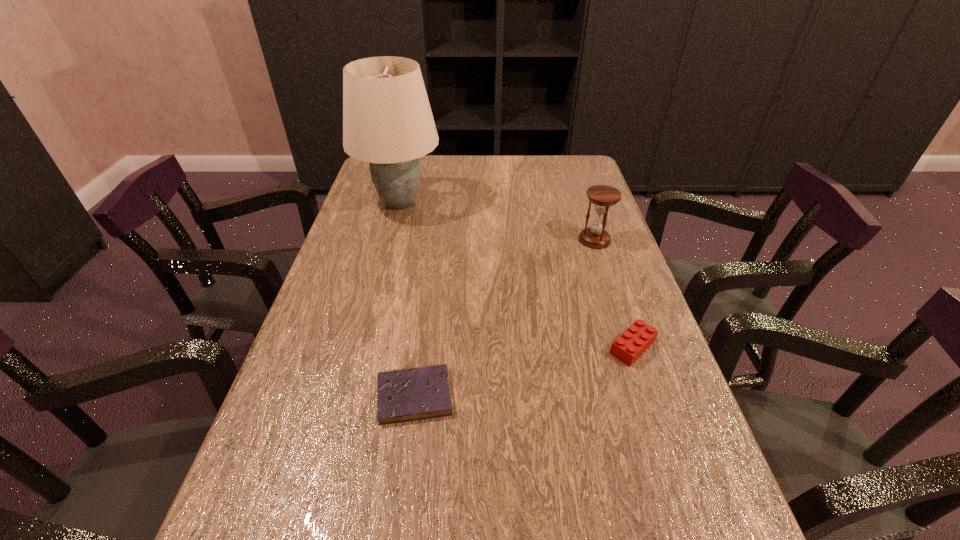
Where is `blank region between the tallest object and the nearest object`? Image resolution: width=960 pixels, height=540 pixels. blank region between the tallest object and the nearest object is located at coordinates (407, 299).

I want to click on object identified as the third closest to the third shortest object, so click(x=419, y=393).

Point out which object is positioned as the nearest to the farthest object. Please provide its 2D coordinates. Your answer should be formatted as a tuple, i.e. [(x, y)], where the tuple contains the x and y coordinates of a point satisfying the conditions above.

[(603, 196)]

Locate an element on the screen. Image resolution: width=960 pixels, height=540 pixels. vacant space that satisfies the following two spatial constraints: 1. on the back side of the second shortest object; 2. on the left side of the nearest object is located at coordinates click(x=420, y=347).

Locate an element on the screen. This screenshot has width=960, height=540. vacant region that satisfies the following two spatial constraints: 1. on the back side of the shortest object; 2. on the left side of the third tallest object is located at coordinates (420, 347).

I want to click on blank space that satisfies the following two spatial constraints: 1. on the front side of the third shortest object; 2. on the right side of the lampshade, so (x=390, y=240).